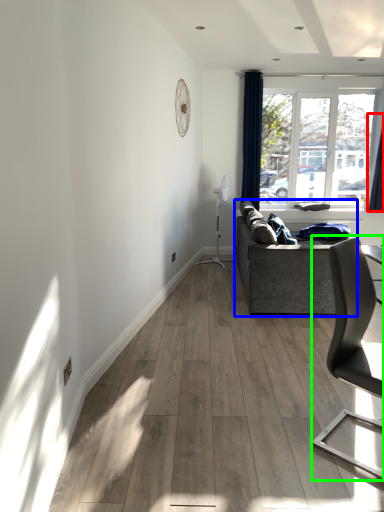
Question: Which is nearer to the curtain (highlighted by a red box)? studio couch (highlighted by a blue box) or chair (highlighted by a green box).

Choices:
 (A) studio couch
 (B) chair

Answer: (A)